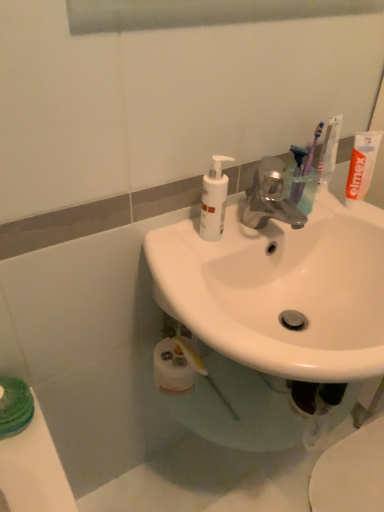
Question: Should I look upward or downward to see translucent plastic toothbrush at upper right, placed as the first toothbrush when sorted from left to right?

Choices:
 (A) down
 (B) up

Answer: (B)

Question: From the image's perspective, is white glossy sink at center above white glossy toilet at lower right?

Choices:
 (A) yes
 (B) no

Answer: (A)

Question: Does white glossy sink at center have a smaller size compared to white glossy toilet at lower right?

Choices:
 (A) no
 (B) yes

Answer: (A)

Question: Is white glossy toilet at lower right a part of white glossy sink at center?

Choices:
 (A) no
 (B) yes

Answer: (A)

Question: Does white glossy sink at center touch white glossy toilet at lower right?

Choices:
 (A) yes
 (B) no

Answer: (B)

Question: Is white glossy sink at center thinner than white glossy toilet at lower right?

Choices:
 (A) no
 (B) yes

Answer: (A)

Question: From a real-world perspective, is white glossy sink at center on white glossy toilet at lower right?

Choices:
 (A) yes
 (B) no

Answer: (A)

Question: Does white matte pump bottle at upper center lie behind purple plastic toothbrush at upper right, acting as the 3th toothbrush starting from the left?

Choices:
 (A) no
 (B) yes

Answer: (A)

Question: From the image's perspective, is white matte pump bottle at upper center above purple plastic toothbrush at upper right, the 1th toothbrush from the right?

Choices:
 (A) yes
 (B) no

Answer: (B)

Question: Would you say white matte pump bottle at upper center is outside purple plastic toothbrush at upper right, acting as the 3th toothbrush starting from the left?

Choices:
 (A) no
 (B) yes

Answer: (B)

Question: Is white matte pump bottle at upper center next to purple plastic toothbrush at upper right, the 1th toothbrush from the right, and touching it?

Choices:
 (A) yes
 (B) no

Answer: (B)

Question: Considering the relative sizes of white matte pump bottle at upper center and purple plastic toothbrush at upper right, acting as the 3th toothbrush starting from the left, in the image provided, is white matte pump bottle at upper center shorter than purple plastic toothbrush at upper right, acting as the 3th toothbrush starting from the left,?

Choices:
 (A) no
 (B) yes

Answer: (B)

Question: From a real-world perspective, is white matte pump bottle at upper center located higher than purple plastic toothbrush at upper right, acting as the 3th toothbrush starting from the left?

Choices:
 (A) no
 (B) yes

Answer: (A)

Question: Can you confirm if translucent plastic toothbrush at upper right, placed as the first toothbrush when sorted from left to right, is smaller than white matte toothpaste at upper right?

Choices:
 (A) no
 (B) yes

Answer: (B)